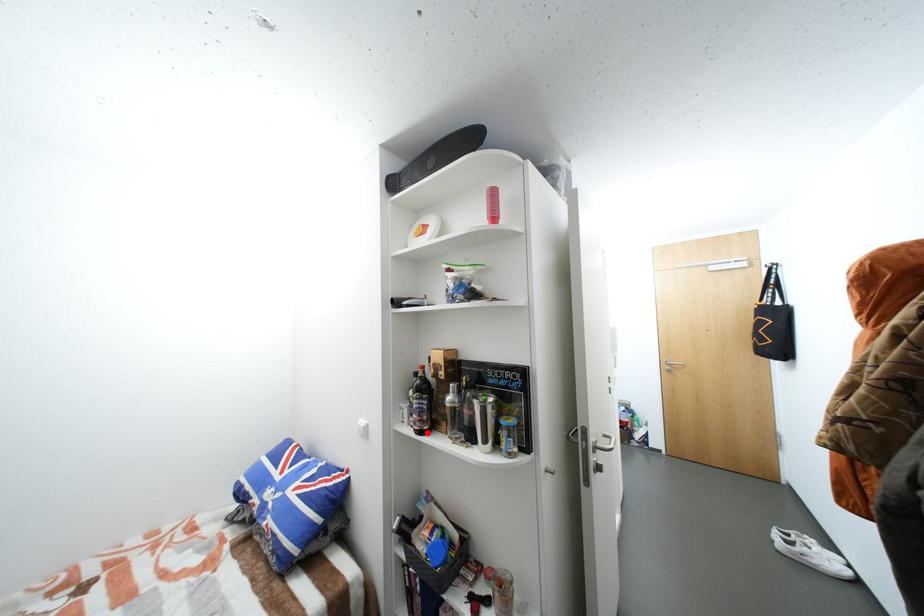
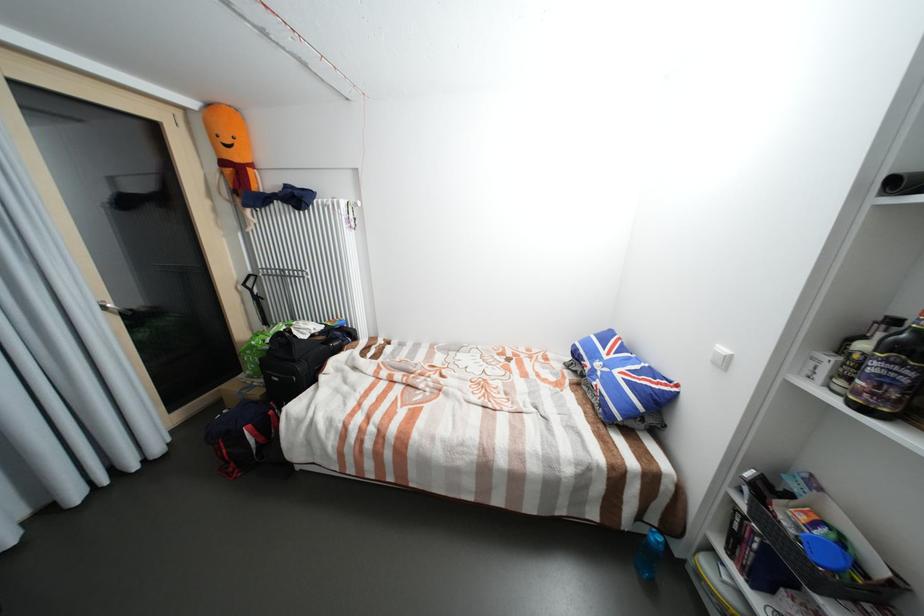
Locate, in the second image, the point that corresponds to the highlighted location in the first image.

(870, 410)